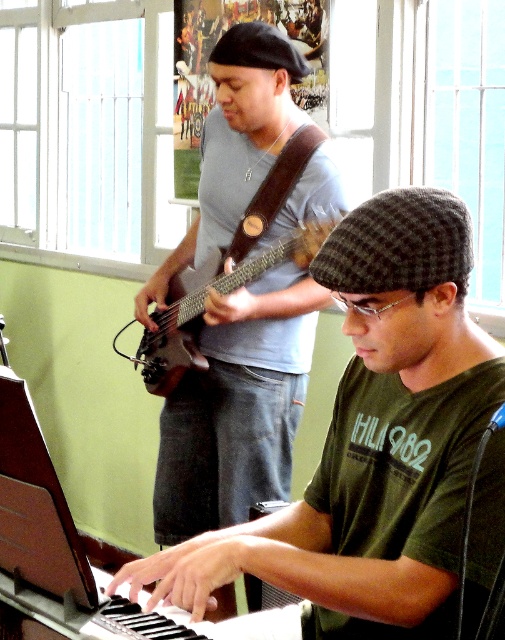
Which is behind, point (203, 426) or point (264, 260)?

The point (203, 426) is behind.

Does point (295, 49) come in front of point (322, 237)?

No, (295, 49) is behind (322, 237).

Locate an element on the screen. Image resolution: width=505 pixels, height=640 pixels. matte gray shirt at center is located at coordinates (236, 406).

You are a GUI agent. You are given a task and a screenshot of the screen. Output one action in this format:
    pyautogui.click(x=<x>, y=<y>)
    Task: Click on the matte gray shirt at center
    
    Given the screenshot: What is the action you would take?
    pyautogui.click(x=236, y=406)

Is point (470, 561) positioned after point (198, 273)?

No, (470, 561) is in front of (198, 273).

Which is in front, point (499, 365) or point (193, 285)?

Point (499, 365)

You are a GUI agent. You are given a task and a screenshot of the screen. Output one action in this format:
    pyautogui.click(x=<x>, y=<y>)
    Task: Click on the green matte shirt at center
    The width and height of the screenshot is (505, 640).
    Given the screenshot: What is the action you would take?
    pyautogui.click(x=373, y=440)

Does green matte shirt at center have a lesser height compared to matte gray shirt at center?

Correct, green matte shirt at center is not as tall as matte gray shirt at center.

Where is `green matte shirt at center`? green matte shirt at center is located at coordinates (373, 440).

Who is more distant from viewer, (427, 202) or (273, 420)?

The point (273, 420) is behind.

This screenshot has height=640, width=505. What are the coordinates of `green matte shirt at center` in the screenshot? It's located at (373, 440).